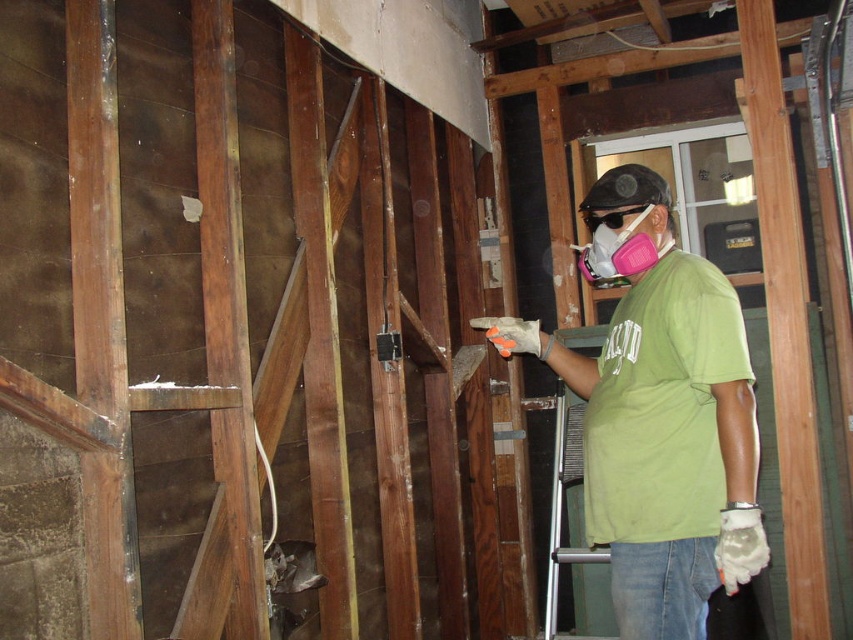
Who is positioned more to the left, green matte shirt at center or pink foam respirator at center?

Positioned to the left is green matte shirt at center.

Can you confirm if green matte shirt at center is thinner than pink foam respirator at center?

No.

Measure the distance between green matte shirt at center and camera.

5.58 feet

Locate an element on the screen. This screenshot has width=853, height=640. green matte shirt at center is located at coordinates (659, 413).